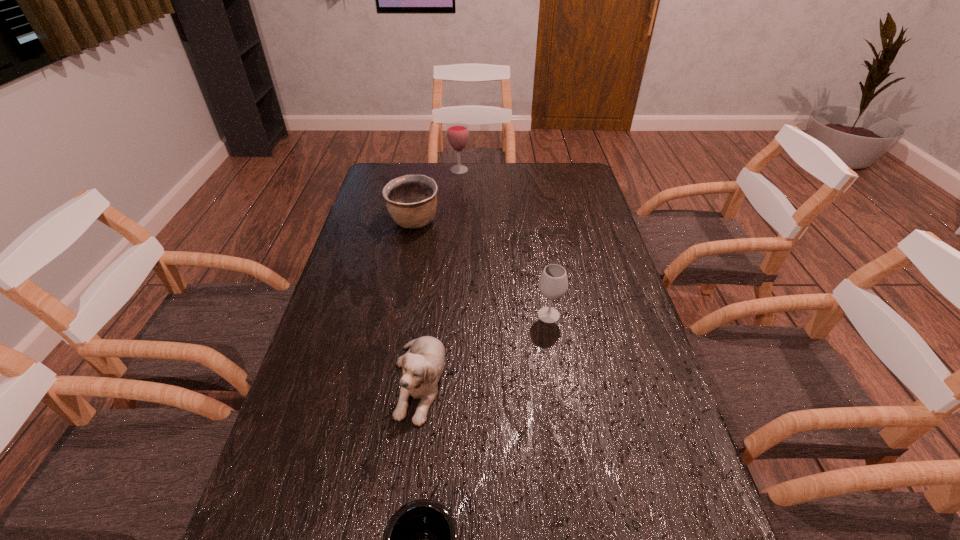
Locate an element on the screen. The height and width of the screenshot is (540, 960). the farther wineglass is located at coordinates (457, 132).

Find the location of a particular element. Image resolution: width=960 pixels, height=540 pixels. the farthest object is located at coordinates (457, 132).

Locate an element on the screen. The image size is (960, 540). the right wineglass is located at coordinates (553, 283).

The image size is (960, 540). What are the coordinates of `the nearer wineglass` in the screenshot? It's located at (553, 283).

Image resolution: width=960 pixels, height=540 pixels. Find the location of `pottery`. pottery is located at coordinates (411, 200).

In order to click on the second nearest object in this screenshot , I will do `click(422, 365)`.

I want to click on free space located on the front of the left wineglass, so click(457, 201).

You are a GUI agent. You are given a task and a screenshot of the screen. Output one action in this format:
    pyautogui.click(x=<x>, y=<y>)
    Task: Click on the vacant space situated 0.190m on the right of the rightmost object
    This screenshot has height=540, width=960.
    Given the screenshot: What is the action you would take?
    pyautogui.click(x=630, y=315)

You are a GUI agent. You are given a task and a screenshot of the screen. Output one action in this format:
    pyautogui.click(x=<x>, y=<y>)
    Task: Click on the vacant space located on the right of the second farthest object
    This screenshot has width=960, height=540.
    Given the screenshot: What is the action you would take?
    pyautogui.click(x=513, y=222)

Where is `vacant space located on the front-facing side of the puppy`? Image resolution: width=960 pixels, height=540 pixels. vacant space located on the front-facing side of the puppy is located at coordinates (411, 449).